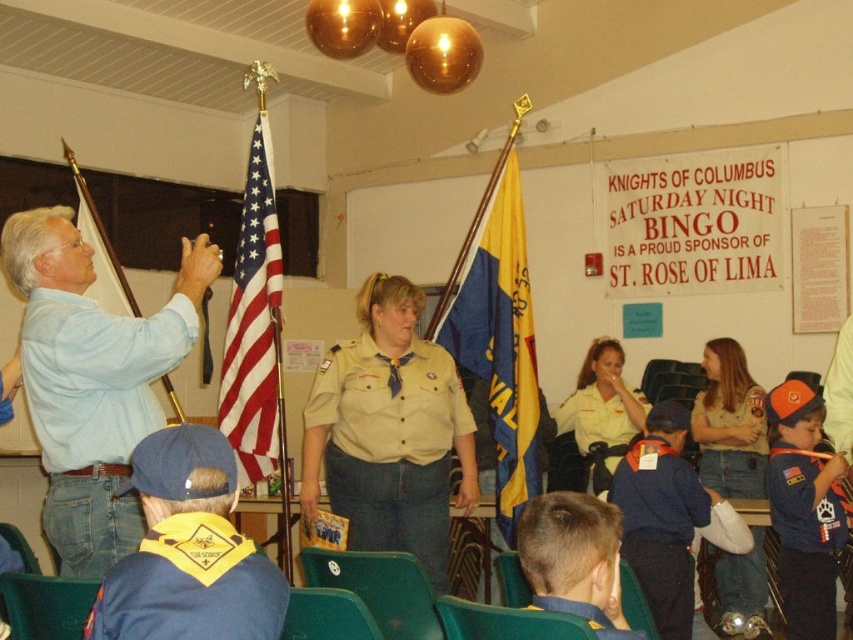
You are organizing a group photo and need to arrange the blue cotton shirt at lower right and the khaki uniform at center so that they are side by side without overlapping. Based on their widths, which one should be placed on the left to ensure they fit within the frame?

The blue cotton shirt at lower right is wider than the khaki uniform at center, so placing the khaki uniform at center on the left and the blue cotton shirt at lower right on the right would allow them to fit side by side without overlapping.

You are standing in the room where the gathering is happening. You notice two points marked on the wall. The first point is at coordinates point (318, 412) and the second point is at point (228, 417). Which point is closer to you?

Point (318, 412) is closer to the camera than point (228, 417), so the first point is closer to you.